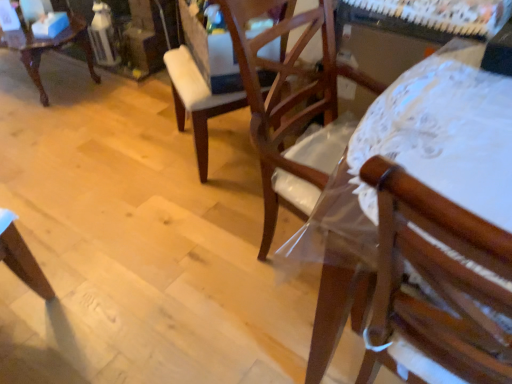
Question: From the image's perspective, does wooden chair at right, which is counted as the 1th chair, starting from the right, appear higher than wooden chair at center, arranged as the second chair when viewed from the left?

Choices:
 (A) no
 (B) yes

Answer: (A)

Question: Can wooden chair at center, the 2th chair positioned from the right, be found inside wooden chair at right, the third chair viewed from the left?

Choices:
 (A) yes
 (B) no

Answer: (B)

Question: Is wooden chair at center, arranged as the second chair when viewed from the left, at the back of wooden chair at right, which is counted as the 1th chair, starting from the right?

Choices:
 (A) yes
 (B) no

Answer: (B)

Question: Are wooden chair at right, the third chair viewed from the back, and wooden chair at center, arranged as the second chair when viewed from the left, located far from each other?

Choices:
 (A) no
 (B) yes

Answer: (A)

Question: From a real-world perspective, is wooden chair at right, which ranks as the 1th chair in front-to-back order, physically below wooden chair at center, the 2th chair positioned from the right?

Choices:
 (A) yes
 (B) no

Answer: (B)

Question: Is wooden chair at center, arranged as the second chair when viewed from the left, situated inside matte white chair at upper left, which is counted as the first chair, starting from the left, or outside?

Choices:
 (A) inside
 (B) outside

Answer: (B)

Question: Is wooden chair at center, which is the 2th chair from back to front, in front of or behind matte white chair at upper left, which is counted as the first chair, starting from the left, in the image?

Choices:
 (A) front
 (B) behind

Answer: (A)

Question: In terms of width, does wooden chair at center, which is the 2th chair from back to front, look wider or thinner when compared to matte white chair at upper left, the 3th chair from the right?

Choices:
 (A) thin
 (B) wide

Answer: (A)

Question: Is point (217, 104) positioned closer to the camera than point (25, 64)?

Choices:
 (A) closer
 (B) farther

Answer: (A)

Question: Based on their sizes in the image, would you say matte white chair at upper left, which is counted as the first chair, starting from the left, is bigger or smaller than wooden chair at right, which is counted as the 1th chair, starting from the right?

Choices:
 (A) big
 (B) small

Answer: (A)

Question: Would you say matte white chair at upper left, which ranks as the 1th chair in back-to-front order, is to the left or to the right of wooden chair at right, the third chair viewed from the back, in the picture?

Choices:
 (A) right
 (B) left

Answer: (B)

Question: Considering the positions of matte white chair at upper left, the 3th chair from the right, and wooden chair at right, the third chair viewed from the back, in the image, is matte white chair at upper left, the 3th chair from the right, taller or shorter than wooden chair at right, the third chair viewed from the back,?

Choices:
 (A) tall
 (B) short

Answer: (B)

Question: In terms of width, does matte white chair at upper left, the 3th chair from the right, look wider or thinner when compared to wooden chair at right, the third chair viewed from the back?

Choices:
 (A) thin
 (B) wide

Answer: (B)

Question: From a real-world perspective, is wooden chair at right, which ranks as the 1th chair in front-to-back order, above or below wooden chair at center, which is the 2th chair from back to front?

Choices:
 (A) above
 (B) below

Answer: (A)

Question: In the image, is wooden chair at right, the third chair viewed from the back, on the left side or the right side of wooden chair at center, which is the 2th chair from back to front?

Choices:
 (A) left
 (B) right

Answer: (B)